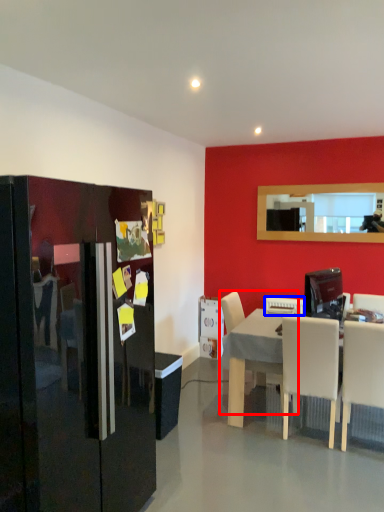
Question: Which of the following is the closest to the observer, chair (highlighted by a red box) or appliance (highlighted by a blue box)?

Choices:
 (A) chair
 (B) appliance

Answer: (A)